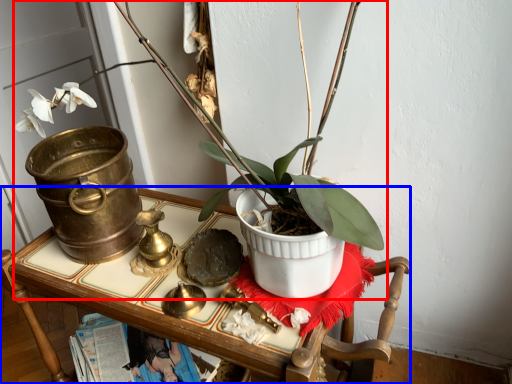
Question: Which object appears closest to the camera in this image, houseplant (highlighted by a red box) or furniture (highlighted by a blue box)?

Choices:
 (A) houseplant
 (B) furniture

Answer: (A)